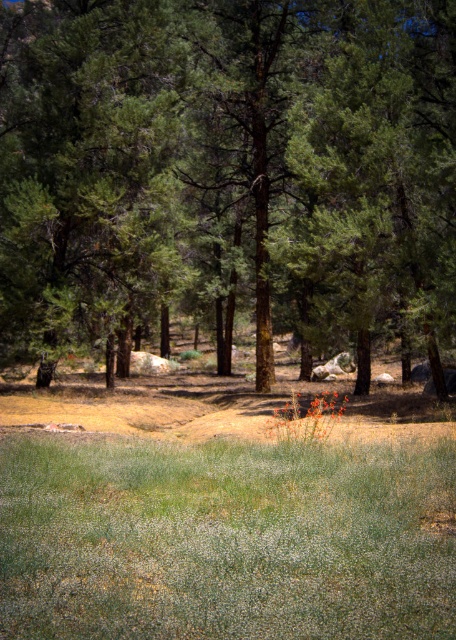
Can you confirm if green textured tree at center is positioned below green soft grass at lower center?

No.

Is point (324, 225) less distant than point (191, 540)?

No, it is behind (191, 540).

The image size is (456, 640). I want to click on green textured tree at center, so click(228, 172).